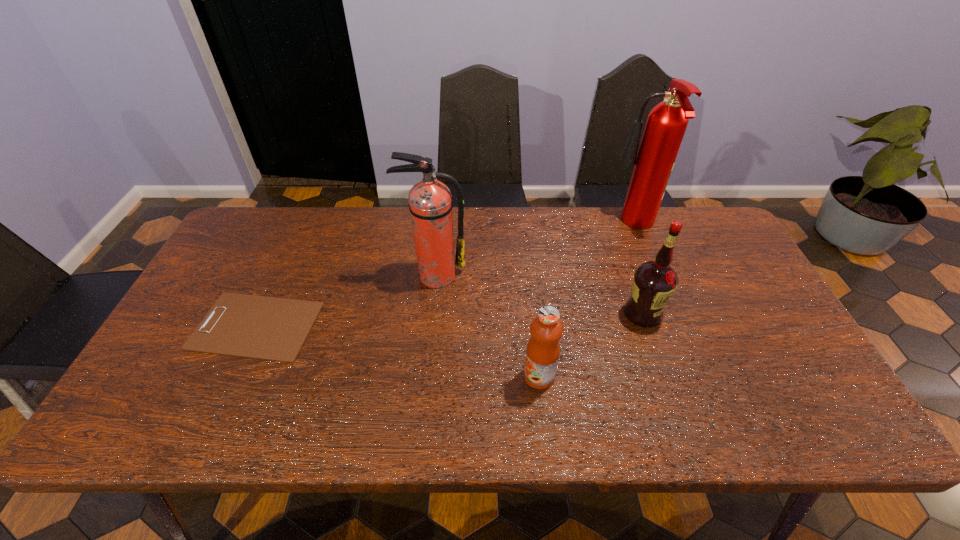
Where is `free spot between the alcohol and the nearest object`? The image size is (960, 540). free spot between the alcohol and the nearest object is located at coordinates (590, 345).

At what (x,y) coordinates should I click in order to perform the action: click on free spot between the nearest object and the left fire extinguisher. Please return your answer as a coordinate pair (x, y). Looking at the image, I should click on (487, 326).

Locate which object is the second closest to the clipboard. Please provide its 2D coordinates. Your answer should be formatted as a tuple, i.e. [(x, y)], where the tuple contains the x and y coordinates of a point satisfying the conditions above.

[(546, 329)]

Locate which object is the third closest to the shortest object. Please provide its 2D coordinates. Your answer should be formatted as a tuple, i.e. [(x, y)], where the tuple contains the x and y coordinates of a point satisfying the conditions above.

[(654, 282)]

You are a GUI agent. You are given a task and a screenshot of the screen. Output one action in this format:
    pyautogui.click(x=<x>, y=<y>)
    Task: Click on the vacant space that satisfies the following two spatial constraints: 1. at the nozzle of the farther fire extinguisher; 2. at the nozzle of the nearer fire extinguisher
    The height and width of the screenshot is (540, 960).
    Given the screenshot: What is the action you would take?
    pyautogui.click(x=653, y=275)

Identify the location of free space in the image that satisfies the following two spatial constraints: 1. on the label of the alcohol; 2. on the front label of the nearest object. This screenshot has width=960, height=540. tap(664, 376).

This screenshot has height=540, width=960. What are the coordinates of `vacant space that satisfies the following two spatial constraints: 1. at the nozzle of the taller fire extinguisher; 2. on the label of the alcohol` in the screenshot? It's located at (668, 314).